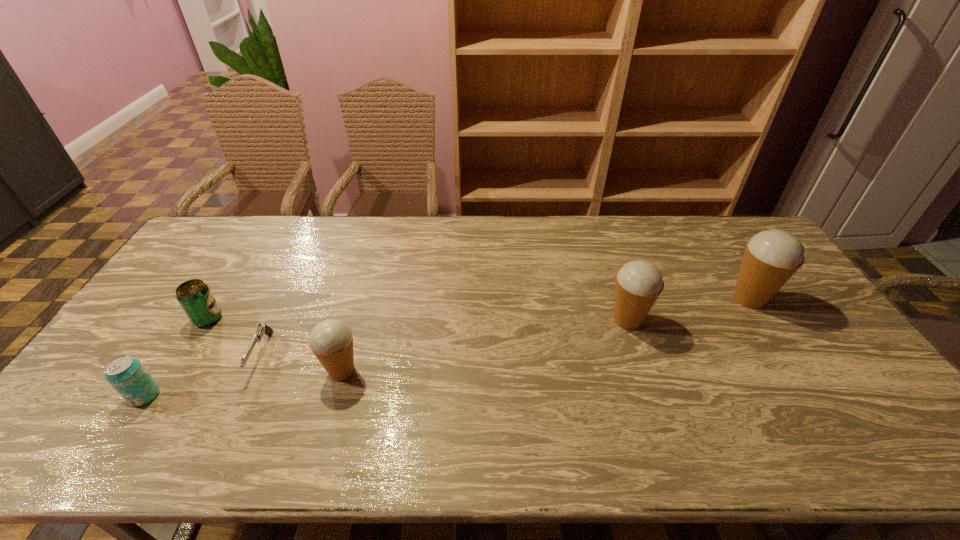
The image size is (960, 540). Identify the location of vacant space at the far edge of the desktop. [660, 225].

The width and height of the screenshot is (960, 540). What are the coordinates of `free spot at the near edge of the desktop` in the screenshot? It's located at (289, 410).

Image resolution: width=960 pixels, height=540 pixels. What are the coordinates of `free space at the left edge` in the screenshot? It's located at (129, 326).

Find the location of `free space at the right edge of the desktop`. free space at the right edge of the desktop is located at coordinates (804, 327).

In order to click on free space at the far left corner in this screenshot , I will do `click(206, 246)`.

This screenshot has height=540, width=960. Identify the location of vacant space at the near left corner of the desktop. (103, 397).

Find the location of `vacant space that's between the rightmost icecream and the third object from left to right`. vacant space that's between the rightmost icecream and the third object from left to right is located at coordinates (505, 326).

What are the coordinates of `vacant space that's between the rightmost icecream and the leftmost icecream` in the screenshot? It's located at tap(545, 335).

This screenshot has width=960, height=540. I want to click on free space between the nearer beer can and the second object from right to left, so click(x=386, y=358).

You are a GUI agent. You are given a task and a screenshot of the screen. Output one action in this format:
    pyautogui.click(x=<x>, y=<y>)
    Task: Click on the unoccupied position between the farther beer can and the nearer beer can
    
    Given the screenshot: What is the action you would take?
    pyautogui.click(x=177, y=357)